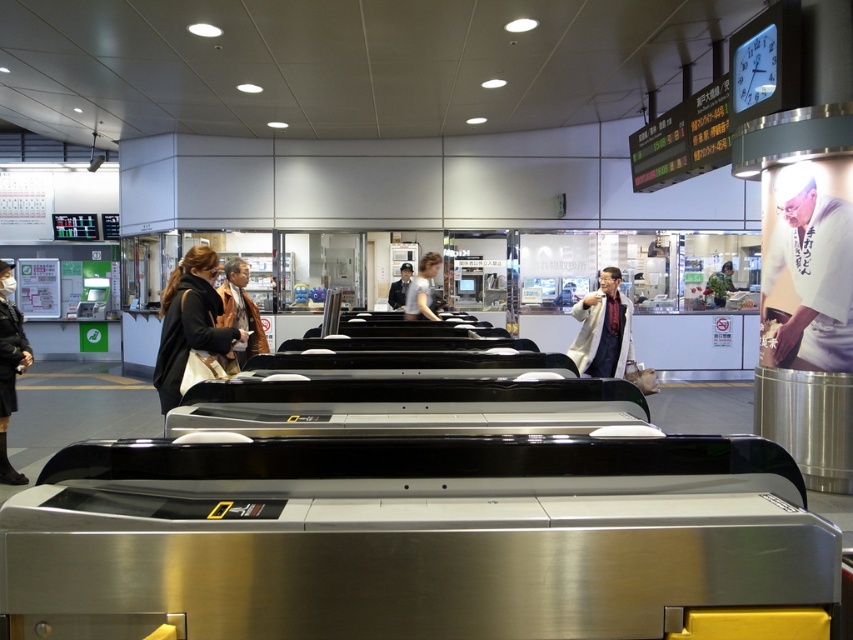
You are standing at the point marked by the coordinate point at point (436, 257). There is a safety barrier at the end of the turnstile that is 7.89 meters away from you. Can you reach the barrier without moving?

The safety barrier at the end of the turnstile is 7.89 meters away from the point at point (436, 257), so you cannot reach it without moving.

You are a security guard at the train station. You notice two people at the center of the scene, a matte black jacket at center and a dark blue suit at center. Which one is closer to you?

The matte black jacket at center is closer to you because it is in front of the dark blue suit at center.

Consider the image. You are standing at the entrance of the train station and see the white matte jacket at center. Can you estimate its location in terms of coordinates?

The white matte jacket at center is located at coordinates point (602, 330).